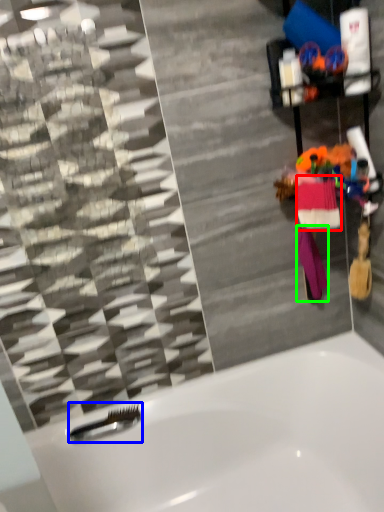
Question: Which is nearer to the clothing (highlighted by a red box)? shower (highlighted by a blue box) or clothing (highlighted by a green box).

Choices:
 (A) shower
 (B) clothing

Answer: (B)